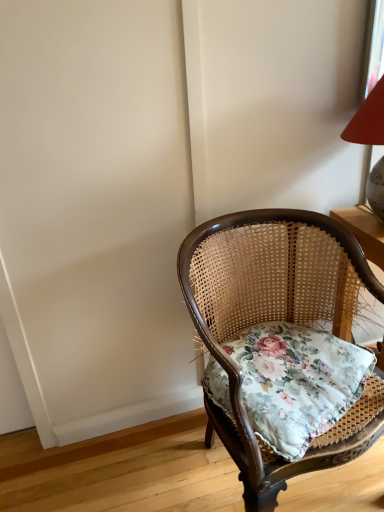
Identify the location of woven wood chair at center. (272, 319).

Describe the element at coordinates (272, 319) in the screenshot. I see `woven wood chair at center` at that location.

The width and height of the screenshot is (384, 512). What do you see at coordinates (300, 385) in the screenshot? I see `floral fabric cushion at center` at bounding box center [300, 385].

This screenshot has width=384, height=512. In order to click on floral fabric cushion at center in this screenshot , I will do `click(300, 385)`.

Find the location of a particular element. This screenshot has height=512, width=384. woven wood chair at center is located at coordinates (272, 319).

Considering the relative positions of floral fabric cushion at center and woven wood chair at center in the image provided, is floral fabric cushion at center to the right of woven wood chair at center from the viewer's perspective?

Indeed, floral fabric cushion at center is positioned on the right side of woven wood chair at center.

Between floral fabric cushion at center and woven wood chair at center, which one is positioned in front?

woven wood chair at center is closer to the camera.

Is point (379, 409) closer or farther from the camera than point (276, 468)?

Point (379, 409).

From the image's perspective, who appears lower, floral fabric cushion at center or woven wood chair at center?

woven wood chair at center is shown below in the image.

From a real-world perspective, which is physically below, floral fabric cushion at center or woven wood chair at center?

woven wood chair at center is physically lower.

Considering the relative sizes of floral fabric cushion at center and woven wood chair at center in the image provided, is floral fabric cushion at center thinner than woven wood chair at center?

Indeed, floral fabric cushion at center has a lesser width compared to woven wood chair at center.

Based on the photo, which of these two, floral fabric cushion at center or woven wood chair at center, stands shorter?

With less height is floral fabric cushion at center.

Can you confirm if floral fabric cushion at center is bigger than woven wood chair at center?

No, floral fabric cushion at center is not bigger than woven wood chair at center.

Can we say floral fabric cushion at center lies outside woven wood chair at center?

No, floral fabric cushion at center is not entirely external to woven wood chair at center.

Is the surface of floral fabric cushion at center in direct contact with woven wood chair at center?

They are not placed beside each other.

Is floral fabric cushion at center oriented away from woven wood chair at center?

Yes, woven wood chair at center is at the back of floral fabric cushion at center.

Can you tell me how much floral fabric cushion at center and woven wood chair at center differ in facing direction?

floral fabric cushion at center and woven wood chair at center are facing 12.7 degrees away from each other.

Locate an element on the screen. Image resolution: width=384 pixels, height=512 pixels. chair below the floral fabric cushion at center (from a real-world perspective) is located at coordinates (272, 319).

Is woven wood chair at center to the right of floral fabric cushion at center from the viewer's perspective?

In fact, woven wood chair at center is to the left of floral fabric cushion at center.

Is the depth of woven wood chair at center greater than that of floral fabric cushion at center?

No, it is in front of floral fabric cushion at center.

Between point (288, 311) and point (224, 404), which one is positioned in front?

The point (224, 404) is more forward.

From the image's perspective, which object appears higher, woven wood chair at center or floral fabric cushion at center?

floral fabric cushion at center.

From a real-world perspective, which is physically below, woven wood chair at center or floral fabric cushion at center?

woven wood chair at center is physically lower.

Which of these two, woven wood chair at center or floral fabric cushion at center, is wider?

Wider between the two is woven wood chair at center.

Is woven wood chair at center taller than floral fabric cushion at center?

Yes, woven wood chair at center is taller than floral fabric cushion at center.

Does woven wood chair at center have a larger size compared to floral fabric cushion at center?

Yes, woven wood chair at center is bigger than floral fabric cushion at center.

Is floral fabric cushion at center surrounded by woven wood chair at center?

That's correct, floral fabric cushion at center is inside woven wood chair at center.

Is woven wood chair at center next to floral fabric cushion at center and touching it?

woven wood chair at center is not next to floral fabric cushion at center, and they're not touching.

From the picture: Is woven wood chair at center oriented away from floral fabric cushion at center?

Yes, floral fabric cushion at center is at the back of woven wood chair at center.

This screenshot has height=512, width=384. Find the location of `chair lying on the left of floral fabric cushion at center`. chair lying on the left of floral fabric cushion at center is located at coordinates (272, 319).

The height and width of the screenshot is (512, 384). In order to click on pillow above the woven wood chair at center (from a real-world perspective) in this screenshot , I will do `click(300, 385)`.

Locate an element on the screen. This screenshot has width=384, height=512. chair lying on the left of floral fabric cushion at center is located at coordinates click(x=272, y=319).